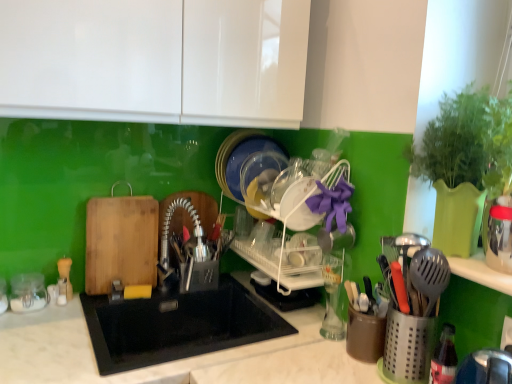
Describe the element at coordinates (177, 325) in the screenshot. The image size is (512, 384). I see `black matte sink at center` at that location.

At what (x,y) coordinates should I click in order to perform the action: click on black matte sink at center. Please return your answer as a coordinate pair (x, y). Looking at the image, I should click on (177, 325).

How different are the orientations of black matte sink at center and clear glass jar at left in degrees?

The facing directions of black matte sink at center and clear glass jar at left are 1.13 degrees apart.

Considering the sizes of objects black matte sink at center and clear glass jar at left in the image provided, who is wider, black matte sink at center or clear glass jar at left?

black matte sink at center is wider.

Which is in front, black matte sink at center or clear glass jar at left?

black matte sink at center is closer to the camera.

Does point (228, 294) come behind point (27, 307)?

Yes, it is behind point (27, 307).

Is clear glass jar at left in contact with black matte sink at center?

clear glass jar at left is not next to black matte sink at center, and they're not touching.

Is point (23, 278) less distant than point (89, 311)?

No, it is not.

From a real-world perspective, between clear glass jar at left and black matte sink at center, who is vertically lower?

From a 3D spatial view, black matte sink at center is below.

Does clear glass jar at left have a smaller size compared to black matte sink at center?

Indeed, clear glass jar at left has a smaller size compared to black matte sink at center.

From the image's perspective, is black matte sink at center under white plastic dish rack at center?

Correct, black matte sink at center appears lower than white plastic dish rack at center in the image.

Find the location of a particular element. This screenshot has height=384, width=512. sink in front of the white plastic dish rack at center is located at coordinates (177, 325).

Considering the relative positions of black matte sink at center and white plastic dish rack at center in the image provided, is black matte sink at center behind white plastic dish rack at center?

No, it is in front of white plastic dish rack at center.

Is white plastic dish rack at center at the back of black matte sink at center?

No.

Looking at their sizes, would you say clear glass jar at left is wider or thinner than white plastic dish rack at center?

Clearly, clear glass jar at left has less width compared to white plastic dish rack at center.

What's the angular difference between clear glass jar at left and white plastic dish rack at center's facing directions?

The facing directions of clear glass jar at left and white plastic dish rack at center are 1.64 degrees apart.

Where is `dish washer above the clear glass jar at left (from the image's perspective)`? The image size is (512, 384). dish washer above the clear glass jar at left (from the image's perspective) is located at coordinates (284, 211).

Is clear glass jar at left at the left side of white plastic dish rack at center?

Correct, you'll find clear glass jar at left to the left of white plastic dish rack at center.

Can you confirm if white plastic dish rack at center is bigger than clear glass jar at left?

Yes, white plastic dish rack at center is bigger than clear glass jar at left.

From the image's perspective, between white plastic dish rack at center and clear glass jar at left, who is located below?

clear glass jar at left.

Between point (317, 176) and point (34, 309), which one is positioned behind?

The point (317, 176) is farther from the camera.

Which of these two, white plastic dish rack at center or clear glass jar at left, is thinner?

Thinner between the two is clear glass jar at left.

Is white plastic dish rack at center next to black matte sink at center and touching it?

No, white plastic dish rack at center is not beside black matte sink at center.

Who is shorter, white plastic dish rack at center or black matte sink at center?

black matte sink at center is shorter.

Between white plastic dish rack at center and black matte sink at center, which one has smaller width?

Thinner between the two is white plastic dish rack at center.

Would you say black matte sink at center is part of white plastic dish rack at center's contents?

Actually, black matte sink at center is outside white plastic dish rack at center.

Identify the location of tableware located above the black matte sink at center (from a real-world perspective). The width and height of the screenshot is (512, 384). (28, 292).

Locate an element on the screen. The image size is (512, 384). tableware that is on the left side of black matte sink at center is located at coordinates (28, 292).

Estimate the real-world distances between objects in this image. Which object is further from white plastic dish rack at center, clear glass jar at left or black matte sink at center?

The object further to white plastic dish rack at center is clear glass jar at left.

Estimate the real-world distances between objects in this image. Which object is further from black matte sink at center, clear glass jar at left or white plastic dish rack at center?

clear glass jar at left is positioned further to the anchor black matte sink at center.

When comparing their distances from black matte sink at center, does white plastic dish rack at center or clear glass jar at left seem further?

clear glass jar at left is further to black matte sink at center.

From the image, which object appears to be nearer to white plastic dish rack at center, black matte sink at center or clear glass jar at left?

black matte sink at center is positioned closer to the anchor white plastic dish rack at center.

Estimate the real-world distances between objects in this image. Which object is further from clear glass jar at left, black matte sink at center or white plastic dish rack at center?

Among the two, white plastic dish rack at center is located further to clear glass jar at left.

Which object lies nearer to the anchor point clear glass jar at left, white plastic dish rack at center or black matte sink at center?

black matte sink at center is positioned closer to the anchor clear glass jar at left.

This screenshot has height=384, width=512. In order to click on sink between clear glass jar at left and white plastic dish rack at center in the horizontal direction in this screenshot , I will do `click(177, 325)`.